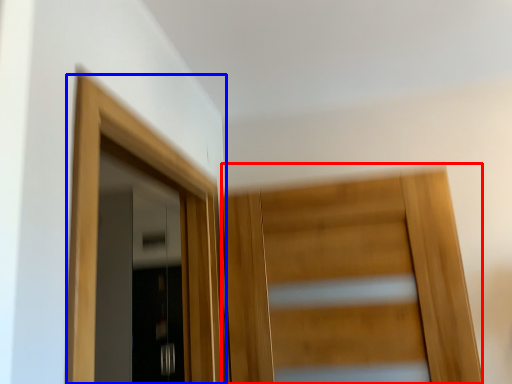
Question: Among these objects, which one is nearest to the camera, door (highlighted by a red box) or door (highlighted by a blue box)?

Choices:
 (A) door
 (B) door

Answer: (B)